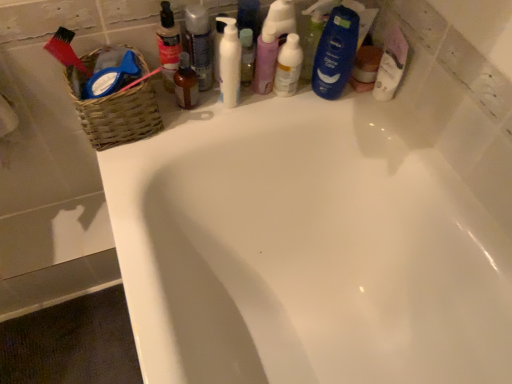
You are a GUI agent. You are given a task and a screenshot of the screen. Output one action in this format:
    pyautogui.click(x=<x>, y=<y>)
    Task: Click on the vacant area that lies in front of translucent plastic bottle at upper center, which is the 1th toiletry in left-to-right order
    
    Given the screenshot: What is the action you would take?
    pyautogui.click(x=160, y=141)